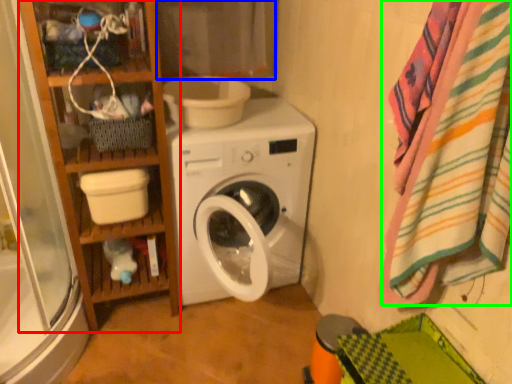
Question: Which is farther away from bookshelf (highlighted by a red box)? curtain (highlighted by a blue box) or bath towel (highlighted by a green box)?

Choices:
 (A) curtain
 (B) bath towel

Answer: (B)